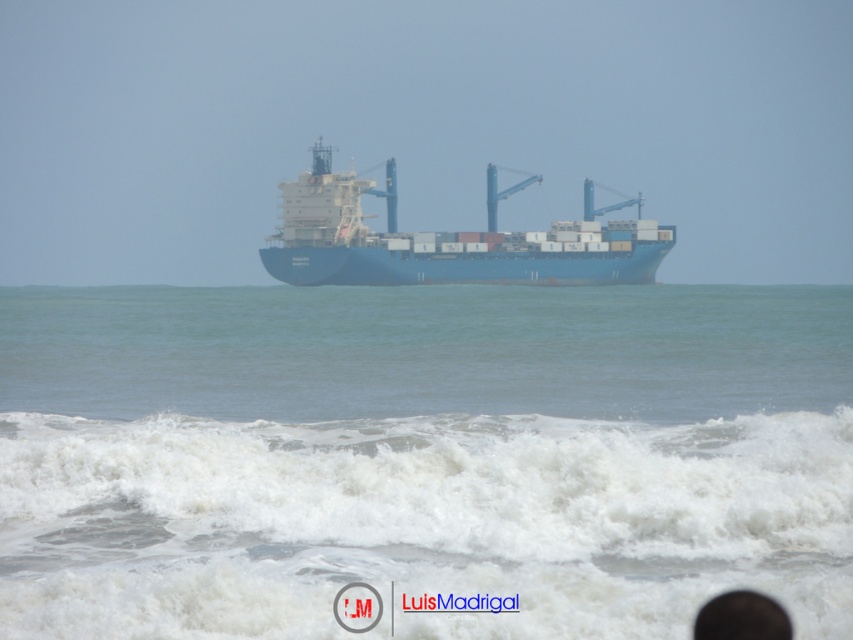
You are standing on the shore and see the blue water at center and the white frothy wave at lower center. Which one is nearer to you?

The white frothy wave at lower center is closer to you than the blue water at center.

You are standing on the shore looking at the ocean. There is a point marked at coordinates (427, 492). What is located at that point?

At point (427, 492) lies the white frothy wave at lower center.